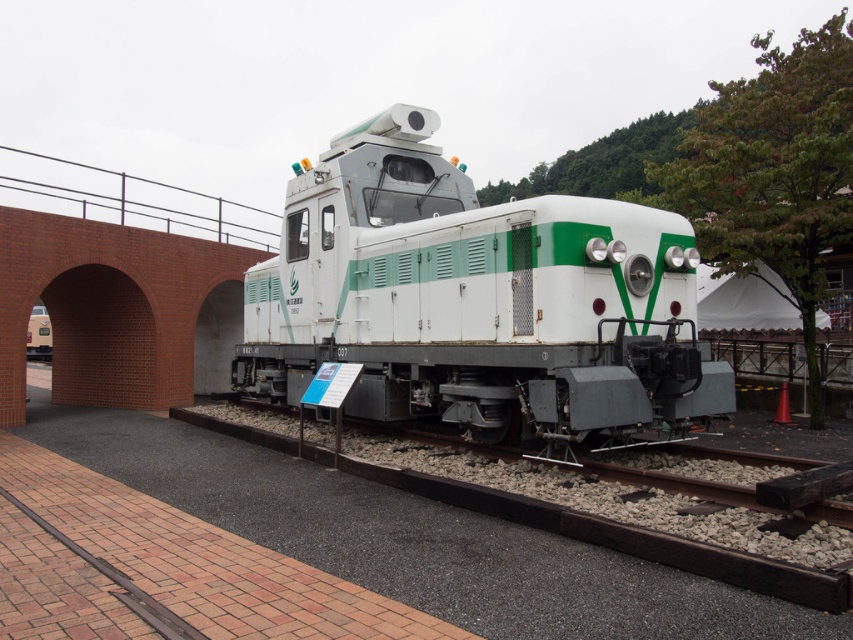
You are standing in front of a locomotive exhibit at a train museum. There is a point at coordinates point (424, 352) that you need to reach. If you can only move forward in a straight line, will you be able to touch that point without moving sideways?

The point at point (424, 352) is 7.76 meters away from you. Since you can move forward in a straight line, you can reach and touch it without needing to move sideways.